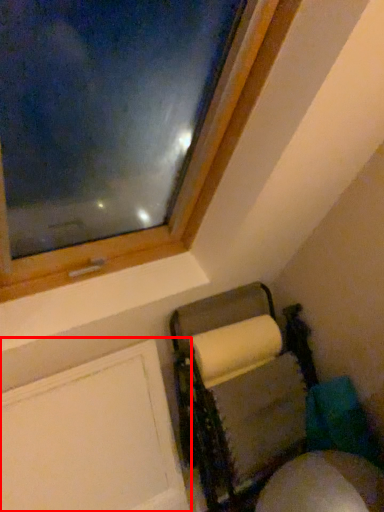
Question: From the image's perspective, what is the correct spatial relationship of screen door (annotated by the red box) in relation to furniture?

Choices:
 (A) below
 (B) above

Answer: (A)